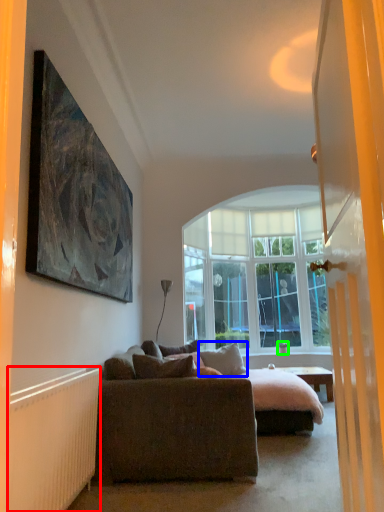
Question: Based on their relative distances, which object is farther from radiator (highlighted by a red box)? Choose from pillow (highlighted by a blue box) and houseplant (highlighted by a green box).

Choices:
 (A) pillow
 (B) houseplant

Answer: (B)